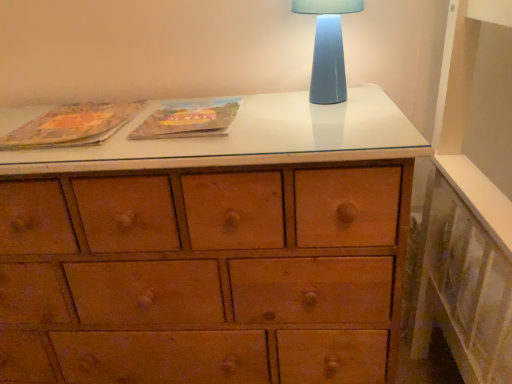
Question: From the image's perspective, is blue ceramic table lamp at upper right on top of matte paper book at upper left, marked as the first paperback book in a left-to-right arrangement?

Choices:
 (A) yes
 (B) no

Answer: (A)

Question: Is blue ceramic table lamp at upper right positioned far away from matte paper book at upper left, marked as the first paperback book in a left-to-right arrangement?

Choices:
 (A) yes
 (B) no

Answer: (B)

Question: Does blue ceramic table lamp at upper right have a lesser width compared to matte paper book at upper left, placed as the second paperback book when sorted from right to left?

Choices:
 (A) yes
 (B) no

Answer: (A)

Question: Is blue ceramic table lamp at upper right in front of matte paper book at upper left, marked as the first paperback book in a left-to-right arrangement?

Choices:
 (A) no
 (B) yes

Answer: (A)

Question: From a real-world perspective, is blue ceramic table lamp at upper right located beneath matte paper book at upper left, placed as the second paperback book when sorted from right to left?

Choices:
 (A) yes
 (B) no

Answer: (B)

Question: Is matte cardboard book at center, marked as the first paperback book in a right-to-left arrangement, wider or thinner than blue ceramic table lamp at upper right?

Choices:
 (A) thin
 (B) wide

Answer: (B)

Question: In terms of height, does matte cardboard book at center, marked as the first paperback book in a right-to-left arrangement, look taller or shorter compared to blue ceramic table lamp at upper right?

Choices:
 (A) tall
 (B) short

Answer: (B)

Question: From a real-world perspective, is matte cardboard book at center, marked as the second paperback book in a left-to-right arrangement, positioned above or below blue ceramic table lamp at upper right?

Choices:
 (A) above
 (B) below

Answer: (B)

Question: Is matte cardboard book at center, marked as the second paperback book in a left-to-right arrangement, bigger or smaller than blue ceramic table lamp at upper right?

Choices:
 (A) big
 (B) small

Answer: (B)

Question: Relative to blue ceramic table lamp at upper right, is matte paper book at upper left, marked as the first paperback book in a left-to-right arrangement, in front or behind?

Choices:
 (A) front
 (B) behind

Answer: (A)

Question: From a real-world perspective, is matte paper book at upper left, marked as the first paperback book in a left-to-right arrangement, above or below blue ceramic table lamp at upper right?

Choices:
 (A) above
 (B) below

Answer: (B)

Question: Considering the positions of point (100, 107) and point (318, 41), is point (100, 107) closer or farther from the camera than point (318, 41)?

Choices:
 (A) farther
 (B) closer

Answer: (A)

Question: From the image's perspective, relative to blue ceramic table lamp at upper right, is matte paper book at upper left, marked as the first paperback book in a left-to-right arrangement, above or below?

Choices:
 (A) below
 (B) above

Answer: (A)

Question: Is blue ceramic table lamp at upper right in front of or behind matte cardboard book at center, marked as the second paperback book in a left-to-right arrangement, in the image?

Choices:
 (A) behind
 (B) front

Answer: (A)

Question: Is blue ceramic table lamp at upper right inside the boundaries of matte cardboard book at center, marked as the second paperback book in a left-to-right arrangement, or outside?

Choices:
 (A) inside
 (B) outside

Answer: (B)